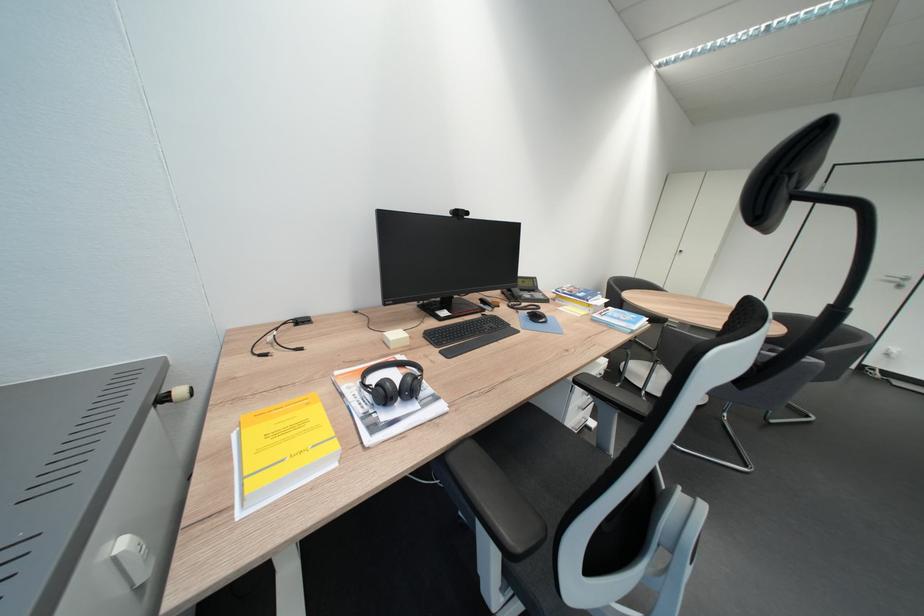
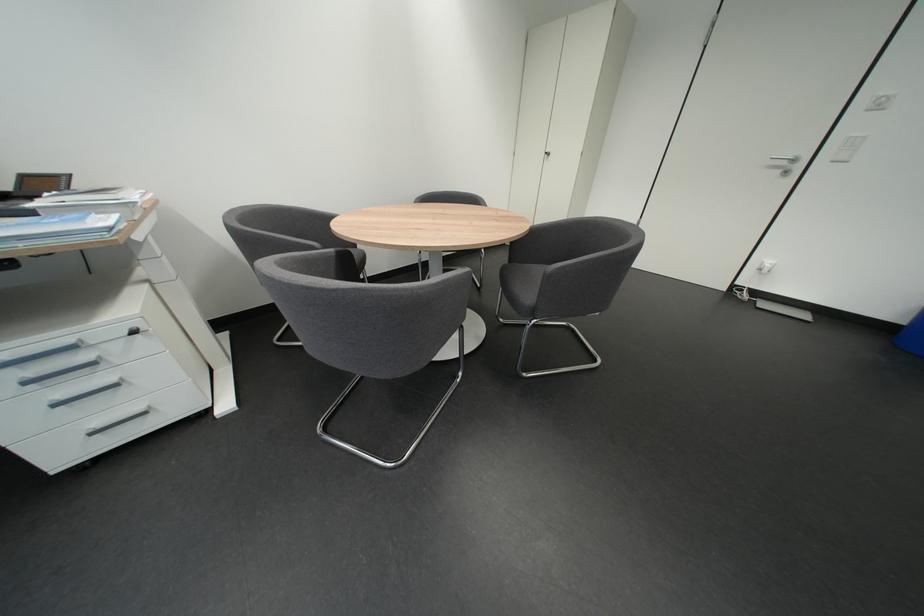
Question: What movement of the cameraman would produce the second image?

Choices:
 (A) Left
 (B) Right
 (C) Forward
 (D) Backward

Answer: (B)